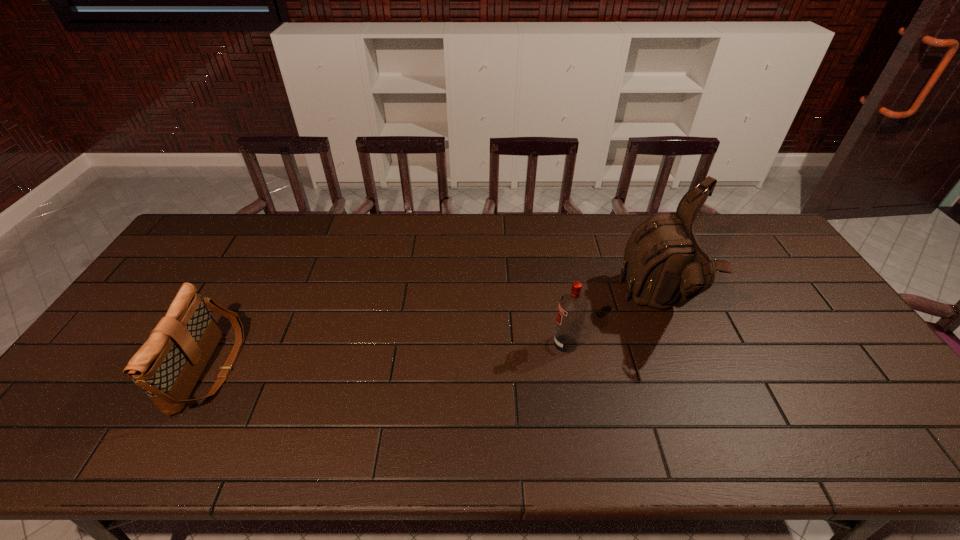
Identify the location of the rightmost object. (665, 266).

Locate an element on the screen. This screenshot has height=540, width=960. the right shoulder bag is located at coordinates (665, 266).

Image resolution: width=960 pixels, height=540 pixels. Identify the location of the second object from left to right. (572, 308).

Find the location of `the leftmost object`. the leftmost object is located at coordinates (168, 365).

What are the coordinates of `the left shoulder bag` in the screenshot? It's located at (168, 365).

Identify the location of vacant space situated 0.230m on the front-facing side of the right shoulder bag. This screenshot has width=960, height=540. coord(547,305).

You are a GUI agent. You are given a task and a screenshot of the screen. Output one action in this format:
    pyautogui.click(x=<x>, y=<y>)
    Task: Click on the free space located on the front-facing side of the right shoulder bag
    This screenshot has width=960, height=540.
    Given the screenshot: What is the action you would take?
    (550, 305)

Locate an element on the screen. This screenshot has height=540, width=960. blank area located on the front-facing side of the right shoulder bag is located at coordinates (557, 305).

Identify the location of vacant space positioned on the front label of the vodka. (534, 343).

The width and height of the screenshot is (960, 540). I want to click on free point located on the front label of the vodka, so click(x=457, y=343).